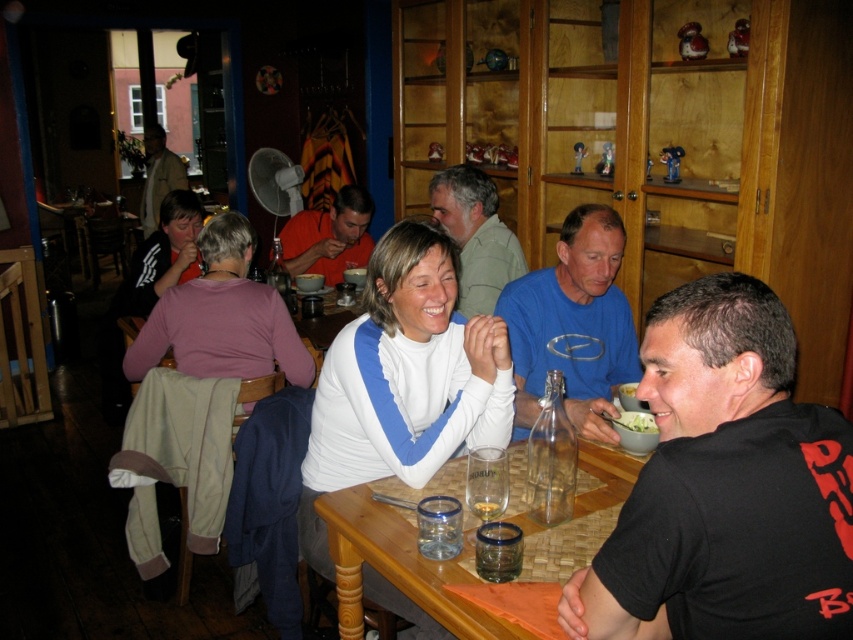
Question: Does pink fabric shirt at upper left have a larger size compared to green leafy salad at lower center?

Choices:
 (A) yes
 (B) no

Answer: (A)

Question: In this image, where is wooden table at center located relative to white matte jacket at upper left?

Choices:
 (A) left
 (B) right

Answer: (B)

Question: Considering the relative positions of white matte sweater at center and light brown leather jacket at upper left in the image provided, where is white matte sweater at center located with respect to light brown leather jacket at upper left?

Choices:
 (A) left
 (B) right

Answer: (B)

Question: Among these objects, which one is nearest to the camera?

Choices:
 (A) white matte sweater at center
 (B) white matte jacket at upper left
 (C) black matte shirt at lower right
 (D) blue cotton shirt at center

Answer: (C)

Question: Which object is positioned closest to the white matte bowl at upper center?

Choices:
 (A) light green fabric shirt at upper center
 (B) white matte sweater at center
 (C) orange t-shirt at center

Answer: (B)

Question: Which point is closer to the camera taking this photo?

Choices:
 (A) (138, 253)
 (B) (413, 531)

Answer: (B)